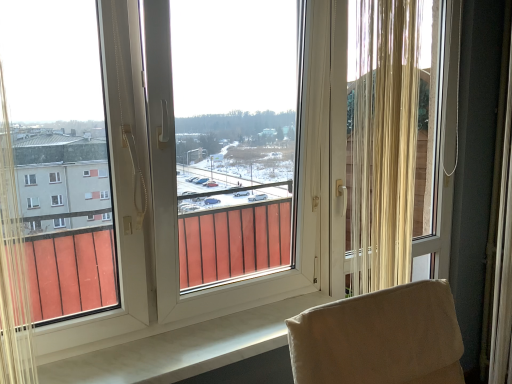
The width and height of the screenshot is (512, 384). Describe the element at coordinates (233, 150) in the screenshot. I see `transparent plastic window screen at center` at that location.

Locate an element on the screen. transparent plastic window screen at center is located at coordinates (233, 150).

What is the approximate width of beige textured curtain at right?

beige textured curtain at right is 1.66 inches wide.

At what (x,y) coordinates should I click in order to perform the action: click on beige textured curtain at right. Please return your answer as a coordinate pair (x, y). Image resolution: width=512 pixels, height=384 pixels. Looking at the image, I should click on (384, 142).

The image size is (512, 384). Describe the element at coordinates (384, 142) in the screenshot. I see `beige textured curtain at right` at that location.

This screenshot has width=512, height=384. Identify the location of transparent plastic window screen at center. (233, 150).

Does beige textured curtain at right appear on the left side of transparent plastic window screen at center?

Incorrect, beige textured curtain at right is not on the left side of transparent plastic window screen at center.

Which object is further away from the camera taking this photo, beige textured curtain at right or transparent plastic window screen at center?

beige textured curtain at right is further from the camera.

Is point (361, 134) less distant than point (319, 64)?

That is True.

From the image's perspective, which is below, beige textured curtain at right or transparent plastic window screen at center?

transparent plastic window screen at center appears lower in the image.

From a real-world perspective, is beige textured curtain at right below transparent plastic window screen at center?

No, from a real-world perspective, beige textured curtain at right is not under transparent plastic window screen at center.

Based on the photo, between beige textured curtain at right and transparent plastic window screen at center, which one has larger width?

transparent plastic window screen at center is wider.

Considering the sizes of beige textured curtain at right and transparent plastic window screen at center in the image, is beige textured curtain at right taller or shorter than transparent plastic window screen at center?

In the image, beige textured curtain at right appears to be shorter than transparent plastic window screen at center.

Considering the sizes of beige textured curtain at right and transparent plastic window screen at center in the image, is beige textured curtain at right bigger or smaller than transparent plastic window screen at center?

beige textured curtain at right is smaller than transparent plastic window screen at center.

Can we say beige textured curtain at right lies outside transparent plastic window screen at center?

Yes, beige textured curtain at right is not within transparent plastic window screen at center.

Is beige textured curtain at right with transparent plastic window screen at center?

No, beige textured curtain at right is not touching transparent plastic window screen at center.

Is beige textured curtain at right oriented away from transparent plastic window screen at center?

Yes, transparent plastic window screen at center is at the back of beige textured curtain at right.

Can you tell me how much beige textured curtain at right and transparent plastic window screen at center differ in facing direction?

The angle between the facing direction of beige textured curtain at right and the facing direction of transparent plastic window screen at center is 0.562 degrees.

Measure the distance from beige textured curtain at right to transparent plastic window screen at center.

beige textured curtain at right is 21.45 inches away from transparent plastic window screen at center.

Identify the location of curtain on the right of the transparent plastic window screen at center. This screenshot has height=384, width=512. (384, 142).

Which is more to the right, transparent plastic window screen at center or beige textured curtain at right?

beige textured curtain at right is more to the right.

Relative to beige textured curtain at right, is transparent plastic window screen at center in front or behind?

transparent plastic window screen at center is positioned closer to the viewer than beige textured curtain at right.

Is point (216, 151) closer to camera compared to point (371, 52)?

No, (216, 151) is further to viewer.

In the scene shown: From the image's perspective, which one is positioned lower, transparent plastic window screen at center or beige textured curtain at right?

transparent plastic window screen at center is shown below in the image.

From a real-world perspective, which object stands above the other?

From a 3D spatial view, beige textured curtain at right is above.

Looking at their sizes, would you say transparent plastic window screen at center is wider or thinner than beige textured curtain at right?

transparent plastic window screen at center is wider than beige textured curtain at right.

From their relative heights in the image, would you say transparent plastic window screen at center is taller or shorter than beige textured curtain at right?

In the image, transparent plastic window screen at center appears to be taller than beige textured curtain at right.

Between transparent plastic window screen at center and beige textured curtain at right, which one has larger size?

transparent plastic window screen at center is bigger.

Is transparent plastic window screen at center surrounding beige textured curtain at right?

That's incorrect, beige textured curtain at right is not inside transparent plastic window screen at center.

Is transparent plastic window screen at center in contact with beige textured curtain at right?

No, transparent plastic window screen at center is not next to beige textured curtain at right.

Is transparent plastic window screen at center facing away from beige textured curtain at right?

That's not correct — transparent plastic window screen at center is not looking away from beige textured curtain at right.

How distant is transparent plastic window screen at center from beige textured curtain at right?

transparent plastic window screen at center and beige textured curtain at right are 21.45 inches apart from each other.

Identify the location of window screen on the left side of beige textured curtain at right. This screenshot has width=512, height=384. (233, 150).

Identify the location of window screen that appears below the beige textured curtain at right (from a real-world perspective). (233, 150).

This screenshot has height=384, width=512. What are the coordinates of `curtain on the right side of transparent plastic window screen at center` in the screenshot? It's located at (384, 142).